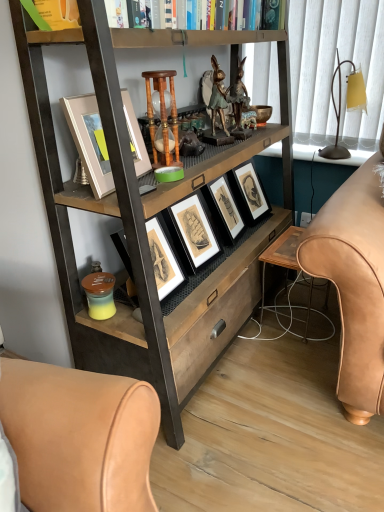
Question: From the image's perspective, relative to wooden bookcase at center, is wooden hourglass at center above or below?

Choices:
 (A) below
 (B) above

Answer: (B)

Question: In terms of height, does wooden hourglass at center look taller or shorter compared to wooden bookcase at center?

Choices:
 (A) tall
 (B) short

Answer: (B)

Question: Estimate the real-world distances between objects in this image. Which object is closer to the matte yellow glass table lamp at right?

Choices:
 (A) hardcover books at upper center
 (B) wooden hourglass at center
 (C) wooden bookcase at center
 (D) wooden table at lower center
 (E) sepia-toned paper picture frame at center, arranged as the first picture frame when viewed from the back

Answer: (E)

Question: Considering the real-world distances, which object is farthest from the hardcover books at upper center?

Choices:
 (A) green patinated metal rabbit at center
 (B) matte white picture frame at upper center, acting as the 1th picture frame starting from the front
 (C) wooden hourglass at center
 (D) sepia-toned paper picture frame at center, arranged as the first picture frame when viewed from the back
 (E) wooden table at lower center

Answer: (E)